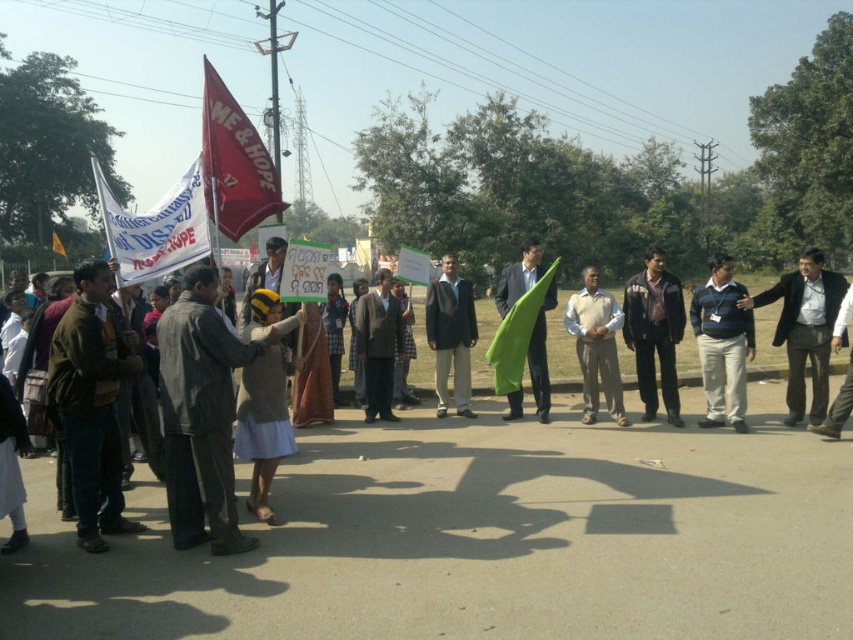
Consider the image. Who is positioned more to the left, black leather jacket at center or red fabric flag at center?

Positioned to the left is red fabric flag at center.

Is black leather jacket at center smaller than red fabric flag at center?

Correct, black leather jacket at center occupies less space than red fabric flag at center.

Between point (668, 396) and point (53, 236), which one is positioned in front?

Positioned in front is point (668, 396).

Where is `black leather jacket at center`? black leather jacket at center is located at coordinates click(654, 332).

Between brown leather jacket at left and dark brown suit at center, which one has more height?

brown leather jacket at left is taller.

Is point (86, 304) positioned after point (358, 358)?

No, (86, 304) is closer to viewer.

Is point (88, 284) positioned behind point (387, 403)?

That is False.

I want to click on brown leather jacket at left, so click(91, 403).

Does brown leather jacket at left have a lesser width compared to red fabric flag at center?

Correct, brown leather jacket at left's width is less than red fabric flag at center's.

Who is more distant from viewer, (109,445) or (54,250)?

The point (54,250) is behind.

Is point (91, 324) farther from camera compared to point (54, 243)?

No, (91, 324) is in front of (54, 243).

Locate an element on the screen. This screenshot has width=853, height=640. brown leather jacket at left is located at coordinates (91, 403).